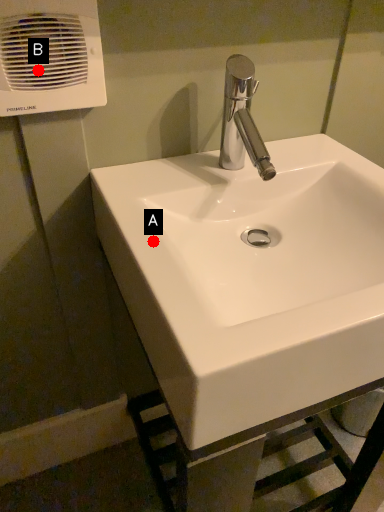
Question: Two points are circled on the image, labeled by A and B beside each circle. Which point is farther from the camera taking this photo?

Choices:
 (A) A is further
 (B) B is further

Answer: (B)